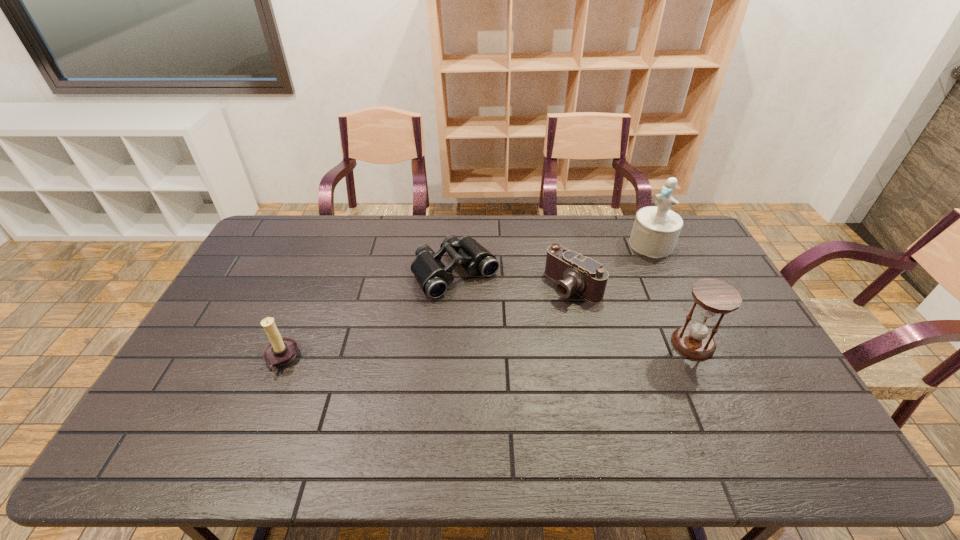
The width and height of the screenshot is (960, 540). I want to click on vacant space that is in between the third shortest object and the binoculars, so click(x=369, y=316).

Locate an element on the screen. free space between the candle holder and the figurine is located at coordinates (467, 302).

Image resolution: width=960 pixels, height=540 pixels. What are the coordinates of `vacant space that's between the third tallest object and the tallest object` in the screenshot? It's located at (467, 302).

The image size is (960, 540). I want to click on unoccupied position between the fourth object from right to left and the second tallest object, so click(x=574, y=308).

This screenshot has width=960, height=540. I want to click on free spot between the hourglass and the camera, so click(634, 315).

Locate an element on the screen. Image resolution: width=960 pixels, height=540 pixels. vacant area between the tallest object and the hourglass is located at coordinates (672, 294).

At what (x,y) coordinates should I click in order to perform the action: click on free space between the figurine and the third tallest object. Please return your answer as a coordinate pair (x, y). Looking at the image, I should click on (467, 302).

The width and height of the screenshot is (960, 540). I want to click on empty space that is in between the camera and the binoculars, so click(x=515, y=279).

This screenshot has width=960, height=540. Find the location of `free area in between the third object from right to left and the fourth shortest object`. free area in between the third object from right to left and the fourth shortest object is located at coordinates 634,315.

Find the location of a particular element. The height and width of the screenshot is (540, 960). empty location between the third tallest object and the third object from right to left is located at coordinates (427, 323).